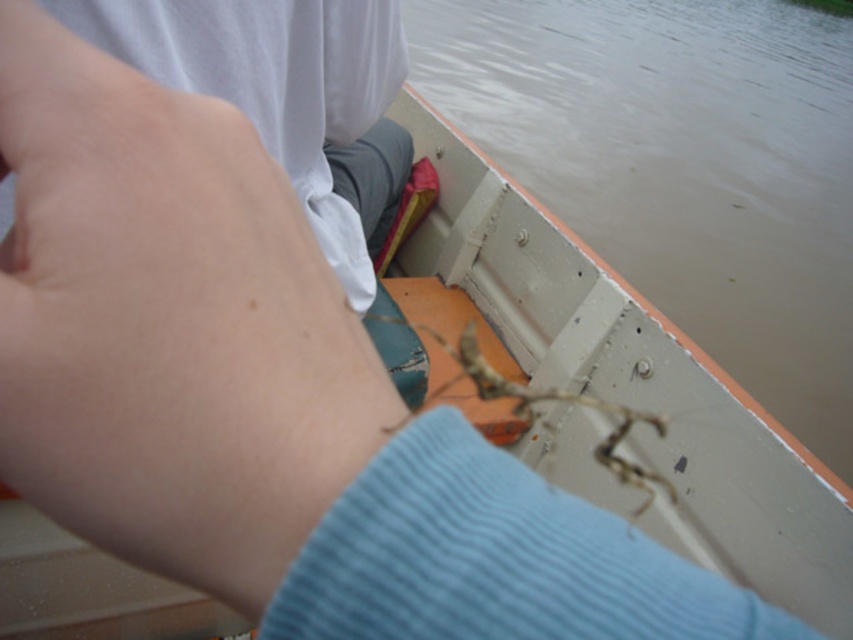
Question: Among these points, which one is farthest from the camera?

Choices:
 (A) pyautogui.click(x=567, y=392)
 (B) pyautogui.click(x=700, y=74)

Answer: (B)

Question: Is muddy water at upper right to the right of brown textured spider at center from the viewer's perspective?

Choices:
 (A) yes
 (B) no

Answer: (A)

Question: Which of the following is the farthest from the observer?

Choices:
 (A) muddy water at upper right
 (B) skinny flesh at center

Answer: (A)

Question: Which of the following is the closest to the observer?

Choices:
 (A) (323, 323)
 (B) (833, 161)
 (C) (625, 406)

Answer: (A)

Question: Can you confirm if skinny flesh at center is wider than brown textured spider at center?

Choices:
 (A) no
 (B) yes

Answer: (A)

Question: Considering the relative positions of skinny flesh at center and brown textured spider at center in the image provided, where is skinny flesh at center located with respect to brown textured spider at center?

Choices:
 (A) left
 (B) right

Answer: (A)